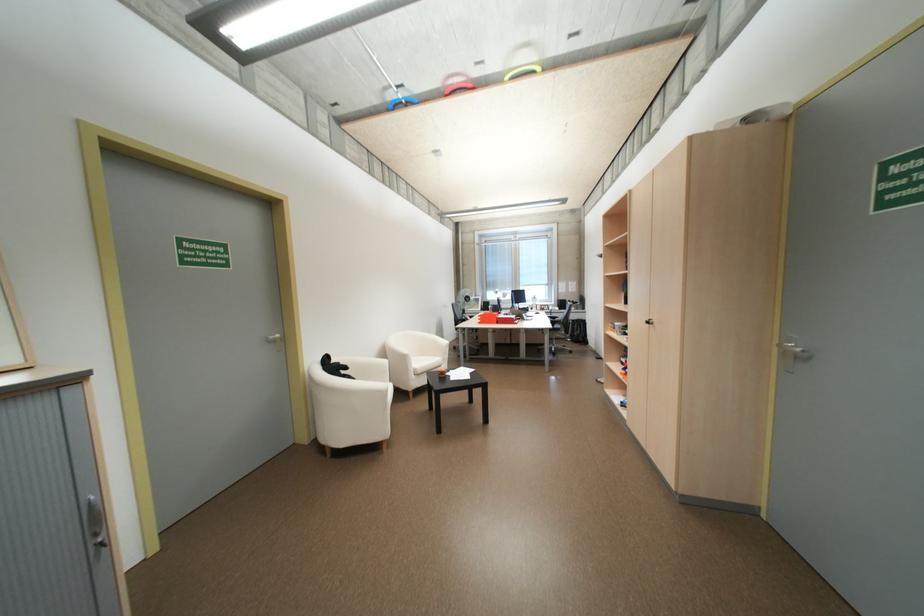
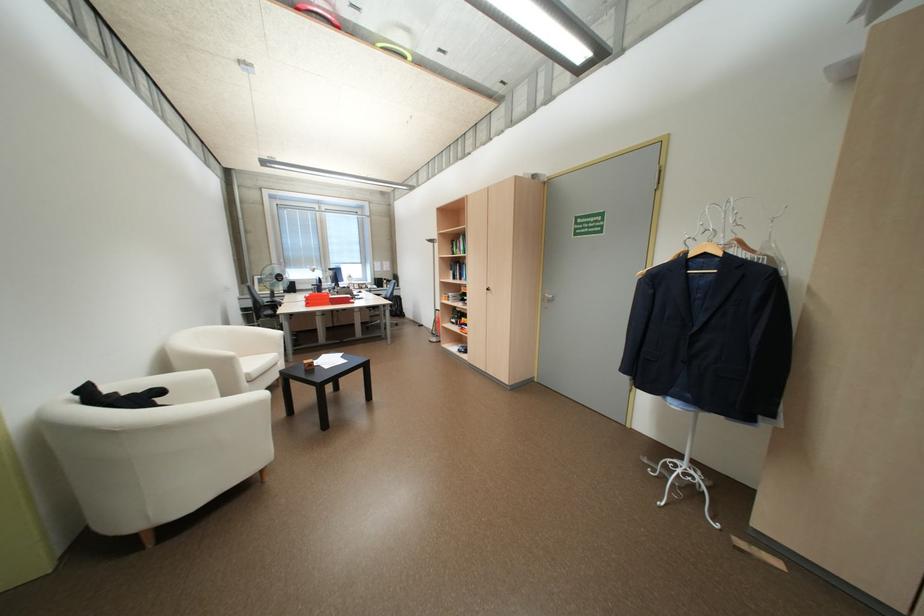
The point at (795, 353) is marked in the first image. Where is the corresponding point in the second image?

(553, 299)